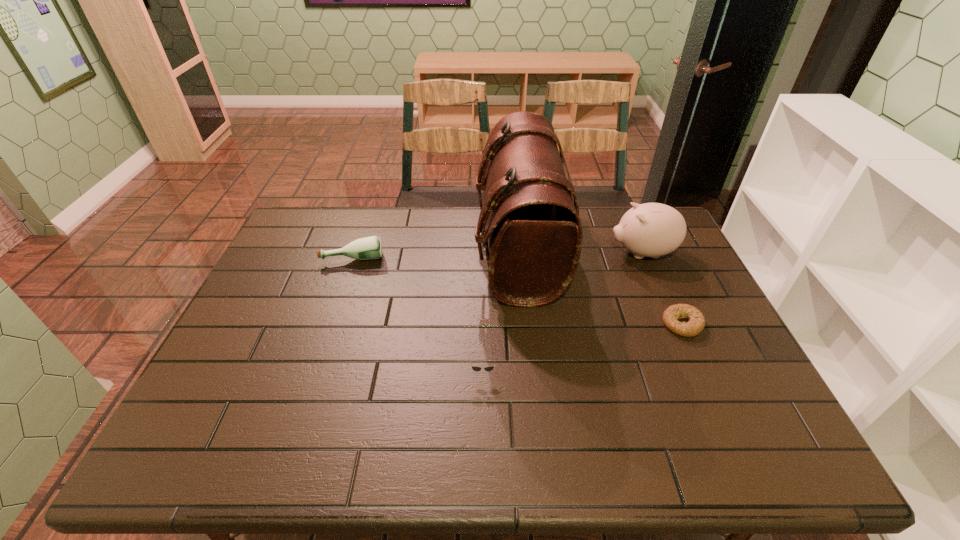
Locate an element on the screen. bagel that is at the right edge is located at coordinates (695, 325).

Identify the location of object that is at the far right corner. (652, 230).

Locate an element on the screen. free space at the far edge is located at coordinates coord(399,228).

Locate an element on the screen. free space at the right edge of the desktop is located at coordinates (704, 342).

At what (x,y) coordinates should I click in order to perform the action: click on vacant space at the far left corner. Please return your answer as a coordinate pair (x, y). Looking at the image, I should click on (315, 238).

Find the location of a particular element. The width and height of the screenshot is (960, 540). free point at the near left corner is located at coordinates (208, 452).

What are the coordinates of `vacant area between the shortest object and the sunglasses` in the screenshot? It's located at (583, 348).

Where is `free space between the satchel and the leftmost object`? free space between the satchel and the leftmost object is located at coordinates (436, 254).

I want to click on vacant space in between the bottle and the tallest object, so click(436, 254).

Locate an element on the screen. This screenshot has width=960, height=540. blank region between the fourth tallest object and the third shortest object is located at coordinates (418, 314).